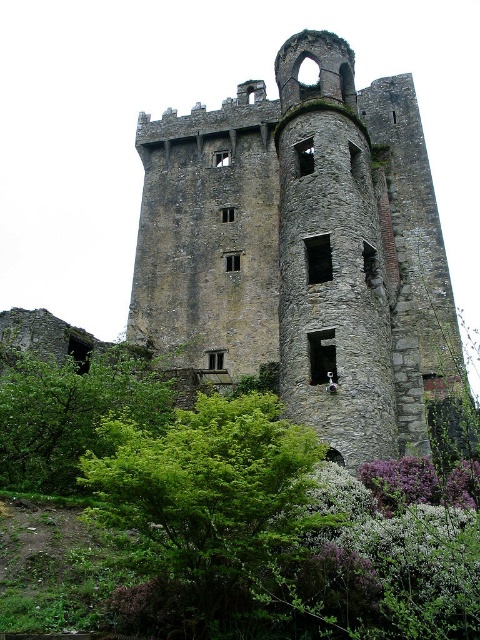
Question: Is gray stone tower at center thinner than green leafy bush at lower center?

Choices:
 (A) yes
 (B) no

Answer: (B)

Question: Which object appears closest to the camera in this image?

Choices:
 (A) green leafy tree at lower left
 (B) gray stone tower at center
 (C) green leafy bush at lower center

Answer: (C)

Question: Which is farther from the gray stone tower at center?

Choices:
 (A) green leafy bush at lower center
 (B) green leafy tree at lower left

Answer: (B)

Question: Does gray stone tower at center come in front of green leafy bush at lower center?

Choices:
 (A) no
 (B) yes

Answer: (A)

Question: Is green leafy bush at lower center wider than green leafy tree at lower left?

Choices:
 (A) yes
 (B) no

Answer: (A)

Question: Which point is closer to the camera?

Choices:
 (A) gray stone tower at center
 (B) green leafy tree at lower left
 (C) green leafy bush at lower center

Answer: (C)